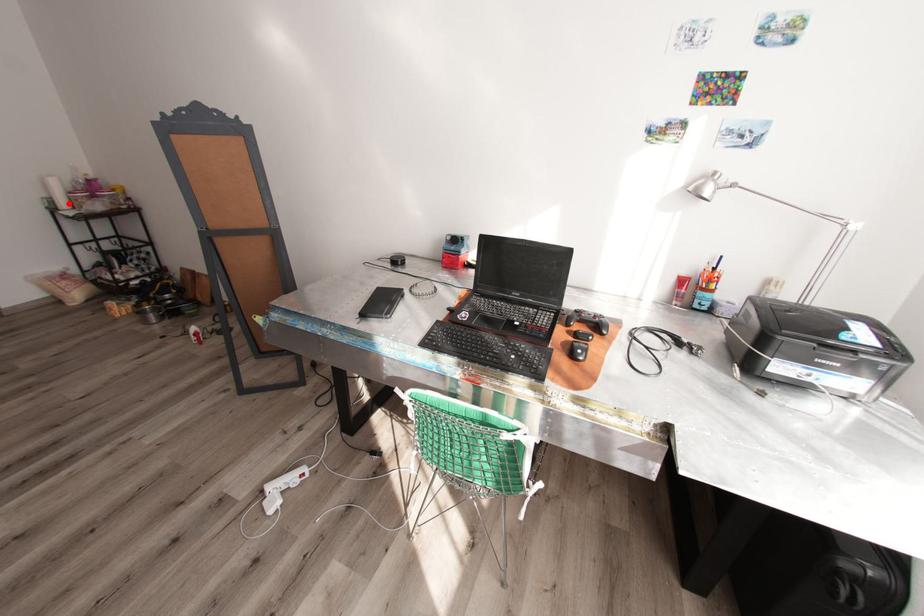
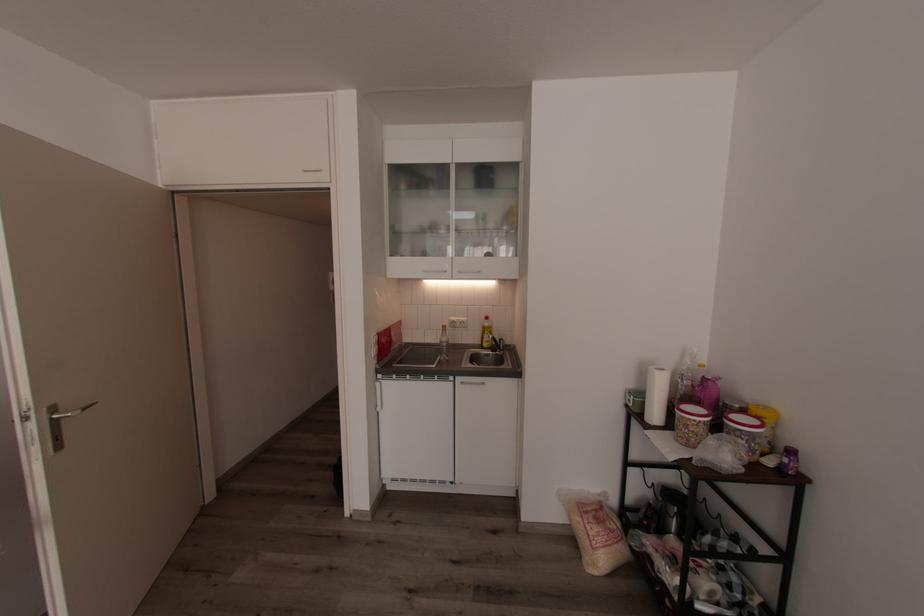
Question: I am providing you with two images of the same scene from different viewpoints. A red point is marked on the first image. At the location where the point appears in image 1, is it still visible in image 2?

Choices:
 (A) Yes
 (B) No

Answer: (A)